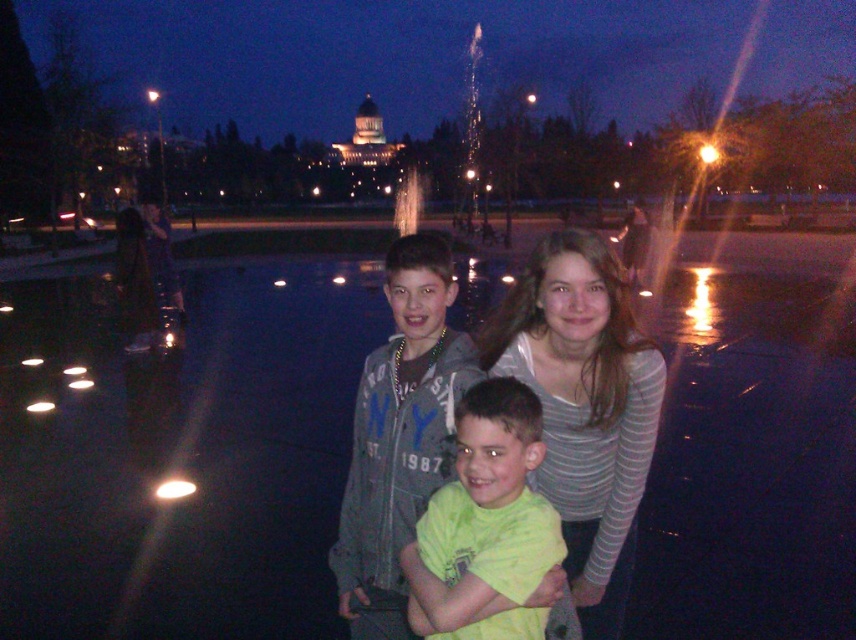
Between striped cotton shirt at center and green matte shirt at center, which one has less height?

green matte shirt at center

Who is lower down, striped cotton shirt at center or green matte shirt at center?

green matte shirt at center is below.

Where is `striped cotton shirt at center`? striped cotton shirt at center is located at coordinates (584, 406).

Is gray denim jacket at center smaller than green matte shirt at center?

No.

Which is below, gray denim jacket at center or green matte shirt at center?

Positioned lower is green matte shirt at center.

Describe the element at coordinates (399, 435) in the screenshot. The width and height of the screenshot is (856, 640). I see `gray denim jacket at center` at that location.

Where is `gray denim jacket at center`? The height and width of the screenshot is (640, 856). gray denim jacket at center is located at coordinates (399, 435).

Is striped cotton shirt at center in front of gray denim jacket at center?

That is False.

Which is in front, point (569, 234) or point (473, 355)?

Point (569, 234)

Where is `striped cotton shirt at center`? striped cotton shirt at center is located at coordinates (584, 406).